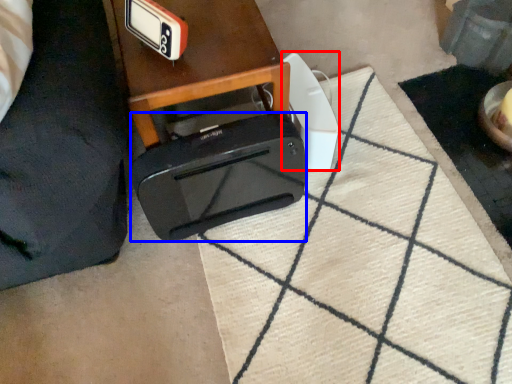
Question: Among these objects, which one is farthest to the camera, appliance (highlighted by a red box) or toaster (highlighted by a blue box)?

Choices:
 (A) appliance
 (B) toaster

Answer: (A)